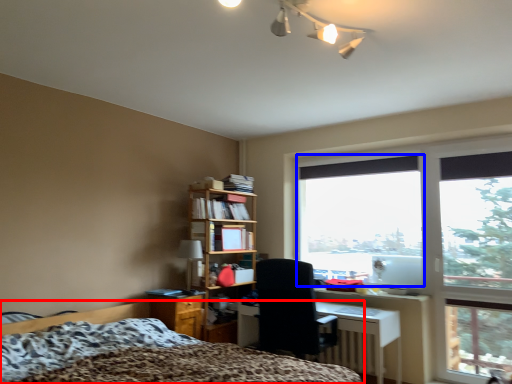
Question: Which point is closer to the camera, bed (highlighted by a red box) or window screen (highlighted by a blue box)?

Choices:
 (A) bed
 (B) window screen

Answer: (A)